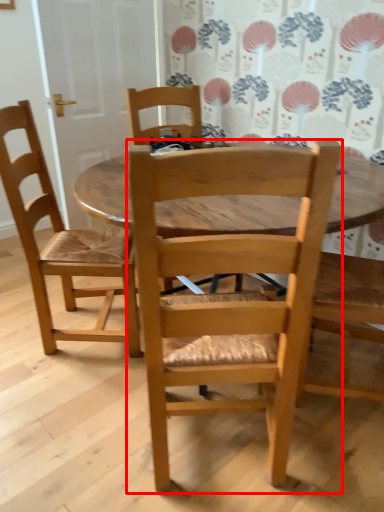
Question: From the image's perspective, where is chair (annotated by the red box) located relative to chair?

Choices:
 (A) below
 (B) above

Answer: (A)